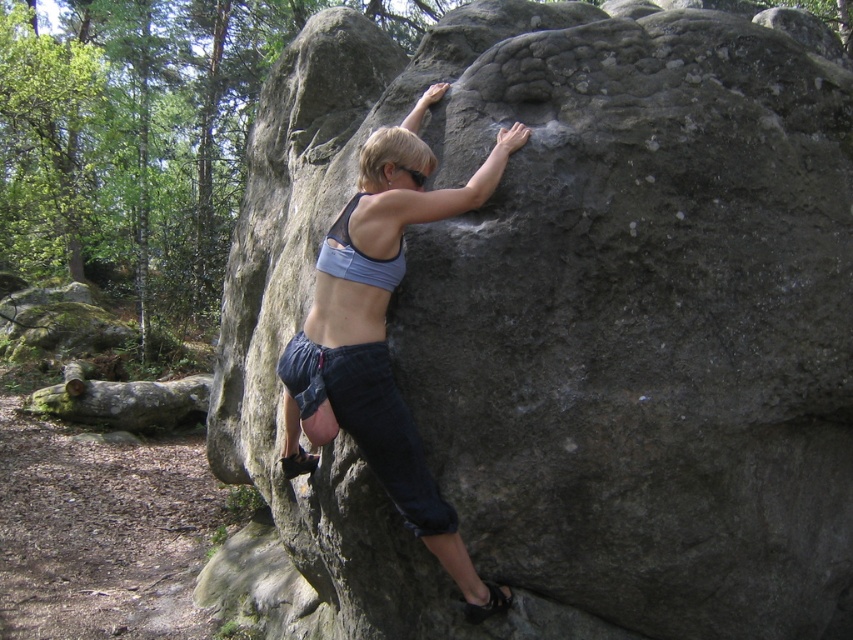
What are the coordinates of the matte gray rock climber at center?

The coordinates of the matte gray rock climber at center are point (384, 333).

You are a rock climbing instructor observing the climber at point (384, 333). Based on the climber position, what is the climber wearing?

The climber at point (384, 333) is wearing a light blue sports bra and dark blue shorts.

You are a photographer trying to capture the climber in the image. You want to ensure both the matte gray rock climber at center and the blue fabric bikini top at center are clearly visible in your shot. Which object should you focus on first to ensure depth of field captures both?

The matte gray rock climber at center is much taller than the blue fabric bikini top at center, so focusing on the climber first will help ensure both are in focus as the top is closer to the camera.